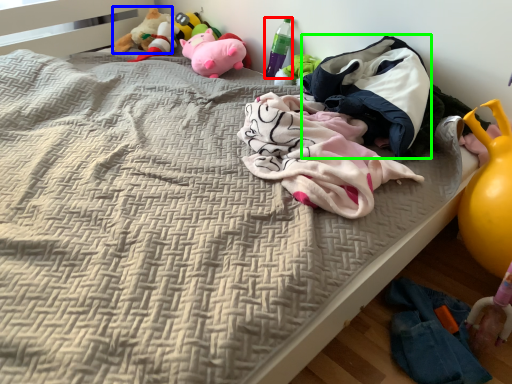
Question: Based on their relative distances, which object is farther from bottle (highlighted by a red box)? Choose from toy (highlighted by a blue box) and baby clothe (highlighted by a green box).

Choices:
 (A) toy
 (B) baby clothe

Answer: (A)